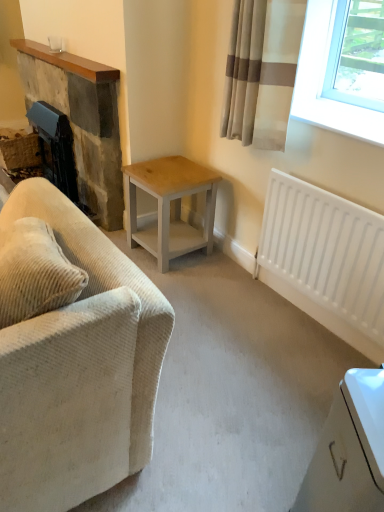
Question: From a real-world perspective, does beige corduroy couch at left stand above white matte radiator at lower right?

Choices:
 (A) no
 (B) yes

Answer: (B)

Question: Is beige corduroy couch at left with white matte radiator at lower right?

Choices:
 (A) no
 (B) yes

Answer: (A)

Question: Can you confirm if beige corduroy couch at left is bigger than white matte radiator at lower right?

Choices:
 (A) no
 (B) yes

Answer: (B)

Question: Is beige corduroy couch at left positioned with its back to white matte radiator at lower right?

Choices:
 (A) no
 (B) yes

Answer: (B)

Question: Is beige corduroy couch at left surrounding white matte radiator at lower right?

Choices:
 (A) no
 (B) yes

Answer: (A)

Question: From the image's perspective, does beige corduroy couch at left appear lower than white matte radiator at lower right?

Choices:
 (A) no
 (B) yes

Answer: (B)

Question: Considering the relative sizes of rustic stone fireplace at left and white matte radiator at lower right in the image provided, is rustic stone fireplace at left bigger than white matte radiator at lower right?

Choices:
 (A) no
 (B) yes

Answer: (B)

Question: Is rustic stone fireplace at left not close to white matte radiator at lower right?

Choices:
 (A) yes
 (B) no

Answer: (A)

Question: Can you confirm if rustic stone fireplace at left is shorter than white matte radiator at lower right?

Choices:
 (A) yes
 (B) no

Answer: (B)

Question: Is rustic stone fireplace at left facing towards white matte radiator at lower right?

Choices:
 (A) no
 (B) yes

Answer: (A)

Question: Does rustic stone fireplace at left appear on the left side of white matte radiator at lower right?

Choices:
 (A) yes
 (B) no

Answer: (A)

Question: From the image's perspective, would you say rustic stone fireplace at left is shown under white matte radiator at lower right?

Choices:
 (A) no
 (B) yes

Answer: (A)

Question: Does light wood/grey painted table at center have a greater height compared to beige corduroy couch at left?

Choices:
 (A) yes
 (B) no

Answer: (B)